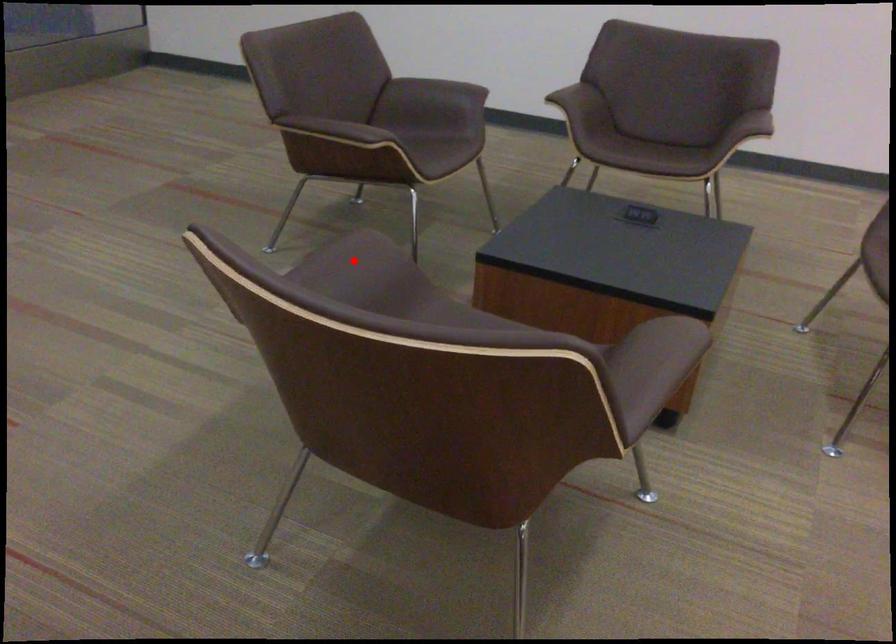
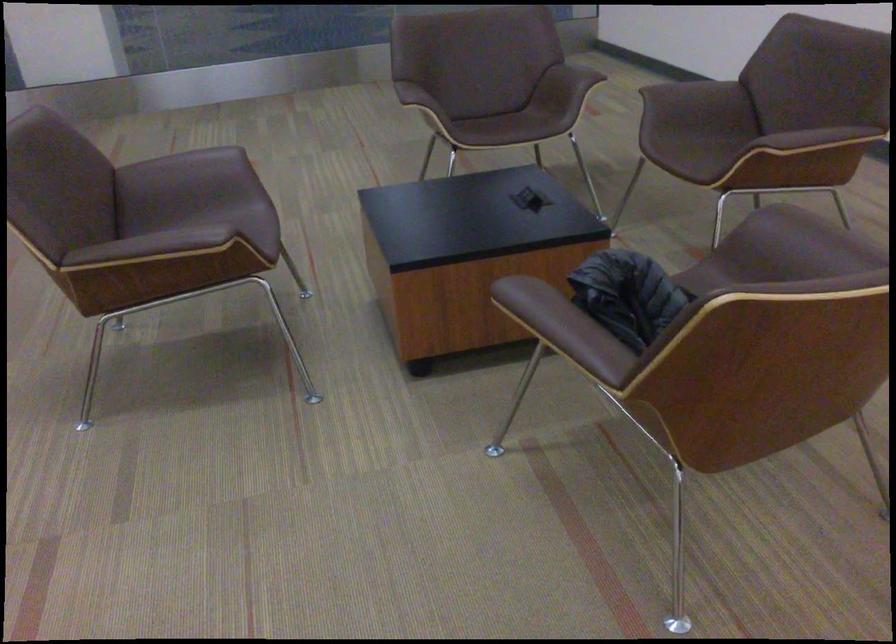
Question: I am providing you with two images of the same scene from different viewpoints. Given a red point in image1, look at the same physical point in image2. Is it:

Choices:
 (A) Closer to the viewpoint
 (B) Farther from the viewpoint

Answer: (B)